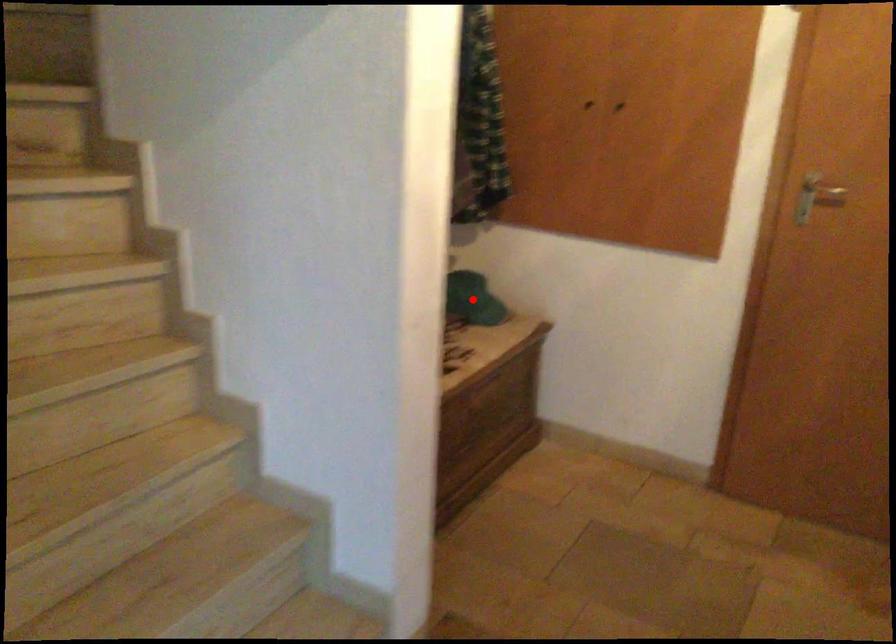
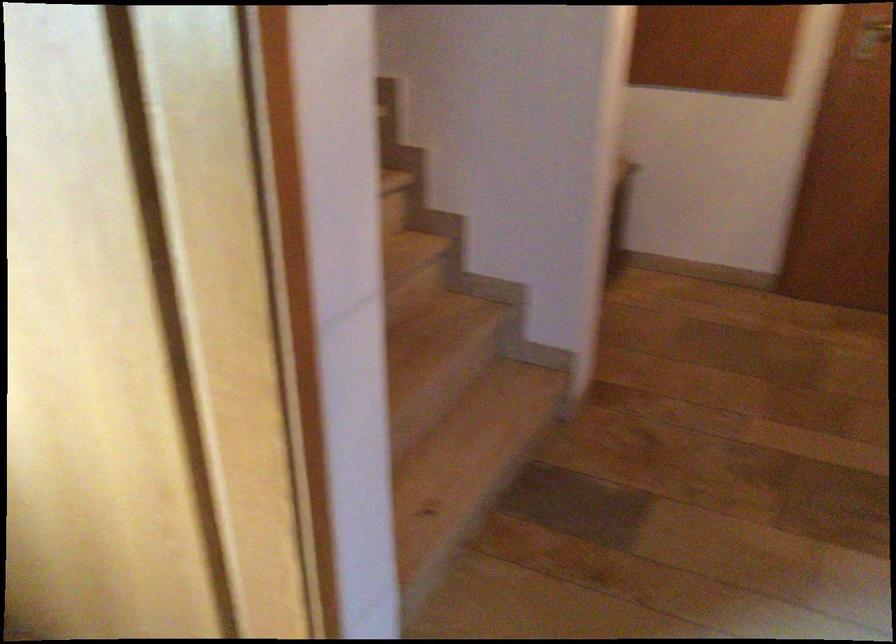
Question: I am providing you with two images of the same scene from different viewpoints. A red point is marked on the first image. Can you still see the location of the red point in image 2?

Choices:
 (A) Yes
 (B) No

Answer: (B)